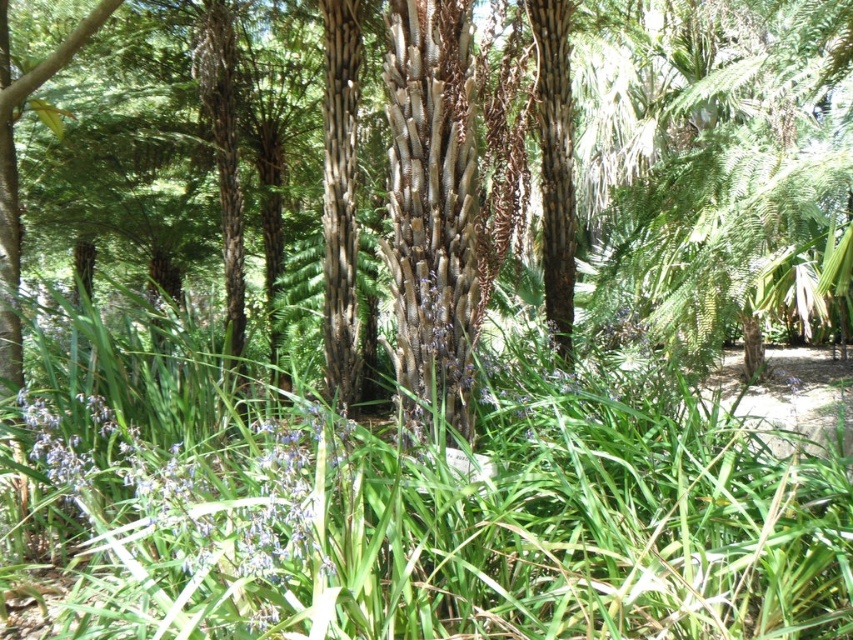
You are standing in the tropical garden described. You notice a point marked at coordinates [426,515]. What is located at this point?

The point at coordinates [426,515] marks green leafy grass at center.

You are a gardener who wants to water the green leafy grass at center and the textured bark palm tree at center. Since you can only reach the plants that are in front of you, which one should you water first?

The green leafy grass at center is in front of the textured bark palm tree at center, so you should water the green leafy grass at center first since it is closer to you.

In the tropical garden scene, you see the green leafy grass at center and the textured bark palm tree at center. Which one is taller?

The textured bark palm tree at center is taller than the green leafy grass at center.